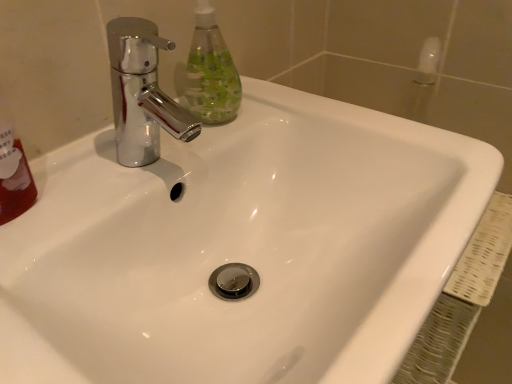
Where is `vacant space to the right of chrome metallic faucet at upper left`? vacant space to the right of chrome metallic faucet at upper left is located at coordinates (292, 130).